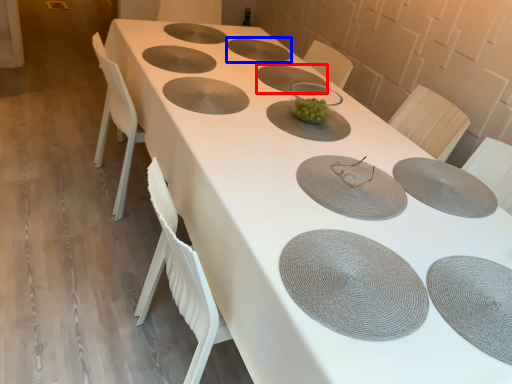
Question: Which of the following is the closest to the observer, plate (highlighted by a red box) or tableware (highlighted by a blue box)?

Choices:
 (A) plate
 (B) tableware

Answer: (A)